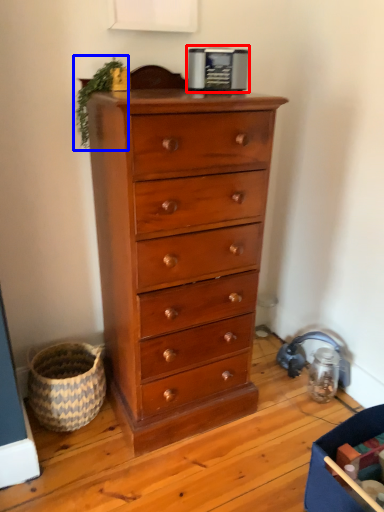
Question: Which of the following is the farthest to the observer, appliance (highlighted by a red box) or plant (highlighted by a blue box)?

Choices:
 (A) appliance
 (B) plant

Answer: (A)